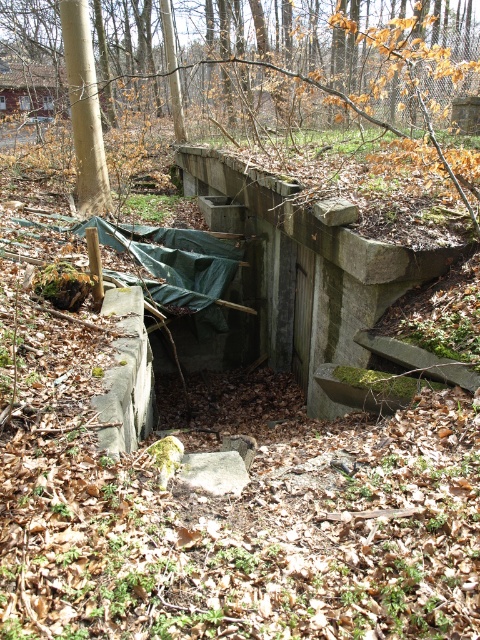
Between brown rough tree at center and green mossy concrete bunker at center, which one appears on the left side from the viewer's perspective?

brown rough tree at center

Between brown rough tree at center and green mossy concrete bunker at center, which one is positioned lower?

green mossy concrete bunker at center is lower down.

Is point (21, 26) positioned after point (261, 314)?

Yes, it is behind point (261, 314).

Locate an element on the screen. This screenshot has height=640, width=480. brown rough tree at center is located at coordinates (314, 97).